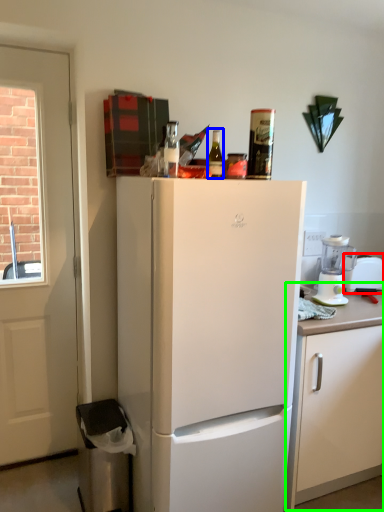
Question: Which object is positioned farthest from appliance (highlighted by a red box)? Select from bottle (highlighted by a blue box) and cabinetry (highlighted by a green box).

Choices:
 (A) bottle
 (B) cabinetry

Answer: (A)